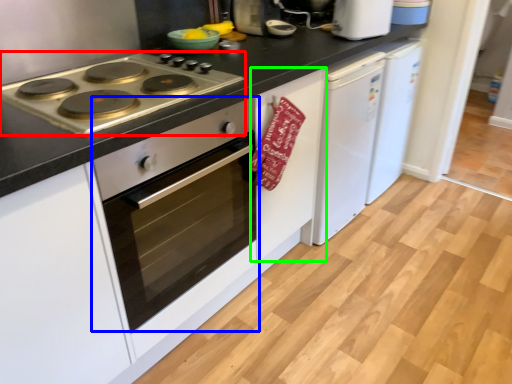
Question: Considering the real-world distances, which object is closest to gas stove (highlighted by a red box)? oven (highlighted by a blue box) or cabinetry (highlighted by a green box).

Choices:
 (A) oven
 (B) cabinetry

Answer: (A)